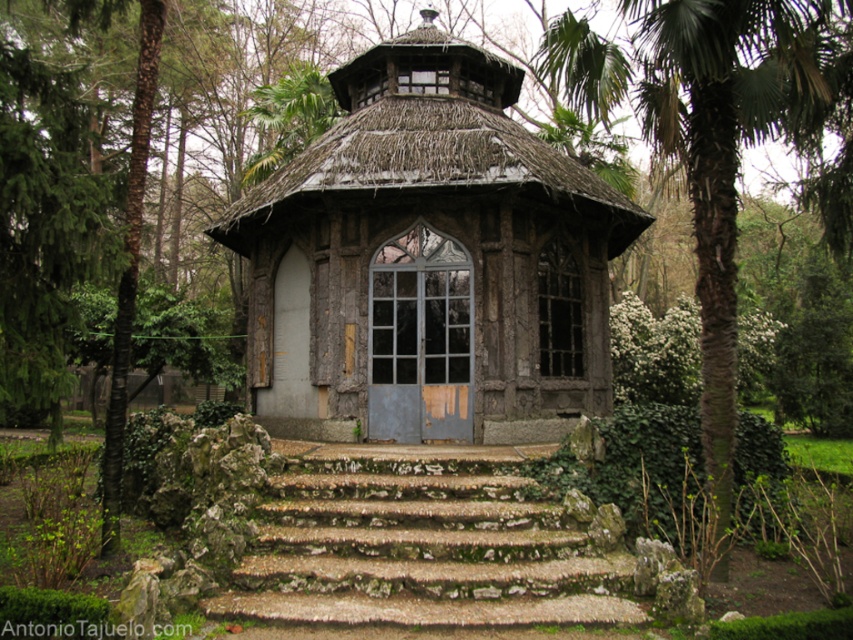
Question: Which point is farther to the camera?

Choices:
 (A) rustic wood gazebo at center
 (B) green leafy palm tree at right

Answer: (A)

Question: Can you confirm if moss-covered stone stairs at center is positioned to the right of green leafy palm tree at right?

Choices:
 (A) no
 (B) yes

Answer: (A)

Question: Among these points, which one is nearest to the camera?

Choices:
 (A) (320, 449)
 (B) (645, 86)
 (C) (282, 346)

Answer: (B)

Question: Which point is closer to the camera?

Choices:
 (A) (718, 58)
 (B) (415, 150)

Answer: (A)

Question: Does rustic wood gazebo at center have a lesser width compared to moss-covered stone stairs at center?

Choices:
 (A) no
 (B) yes

Answer: (B)

Question: Is moss-covered stone stairs at center positioned behind green leafy palm tree at right?

Choices:
 (A) yes
 (B) no

Answer: (B)